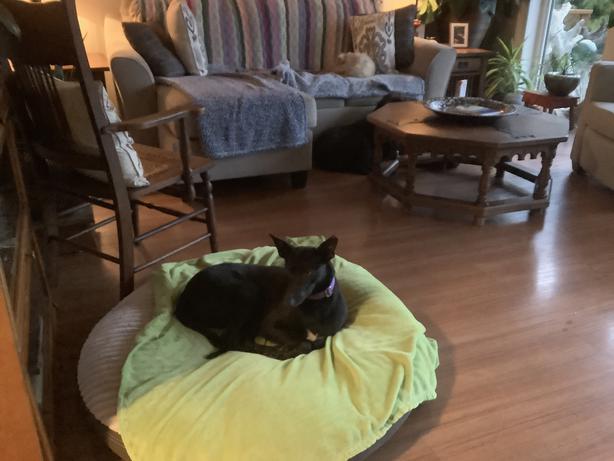
I want to click on picture, so click(455, 29).